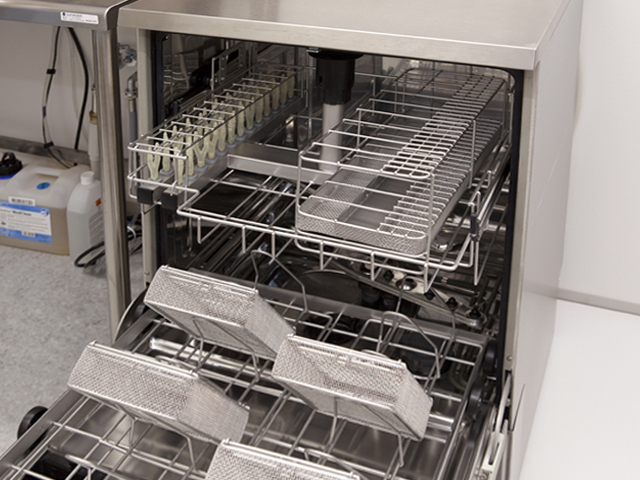
I want to click on basket, so click(x=180, y=390), click(x=235, y=442), click(x=313, y=400), click(x=237, y=307).